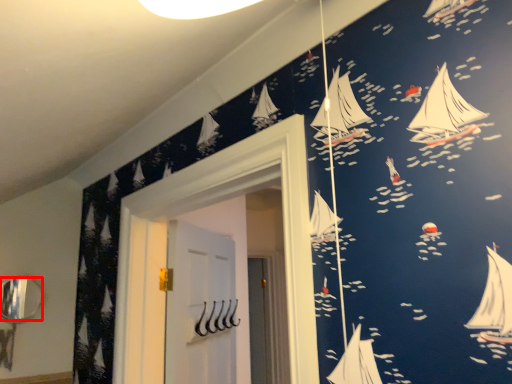
Question: From the image's perspective, where is mirror (annotated by the red box) located in relation to door in the image?

Choices:
 (A) below
 (B) above

Answer: (B)